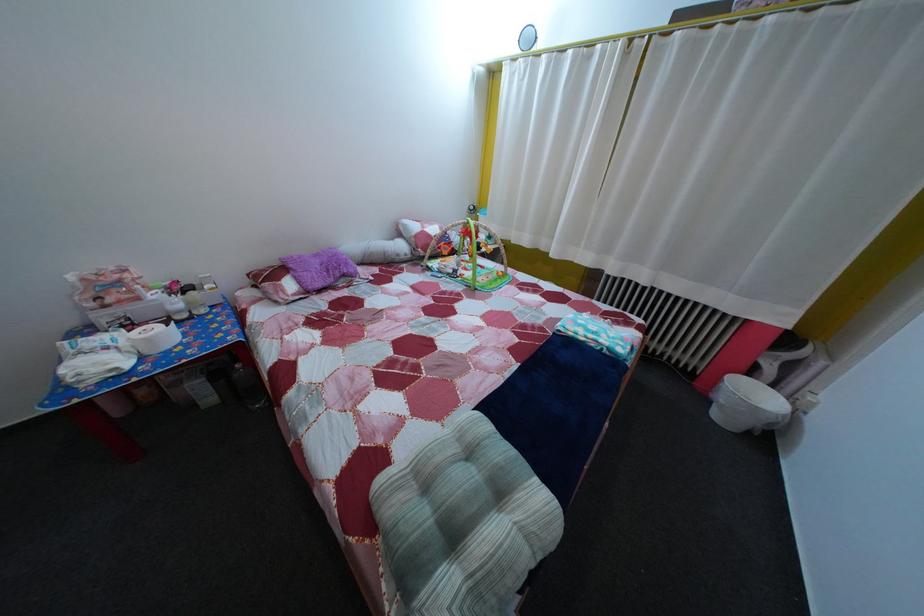
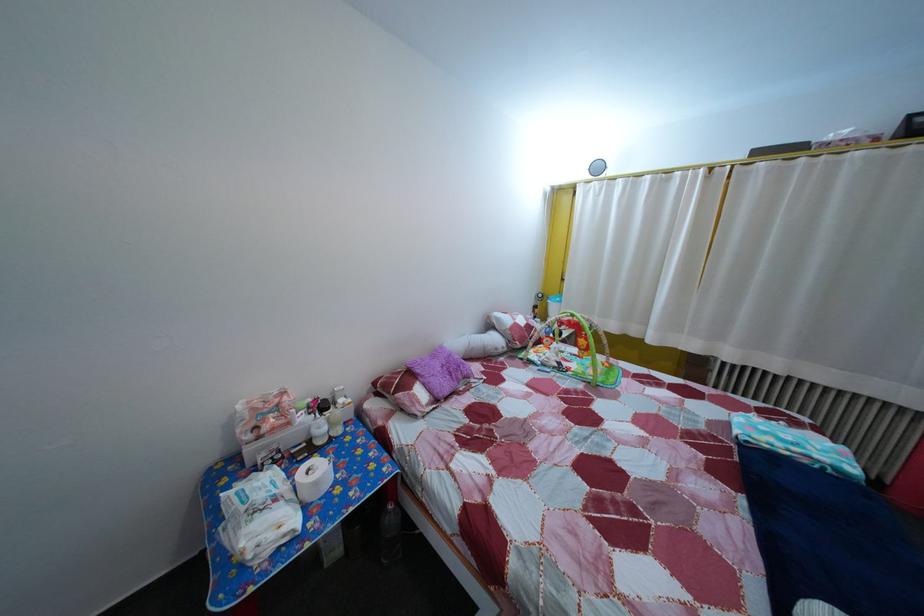
Where in the second image is the point corresponding to pixel 148 307 from the first image?

(298, 432)